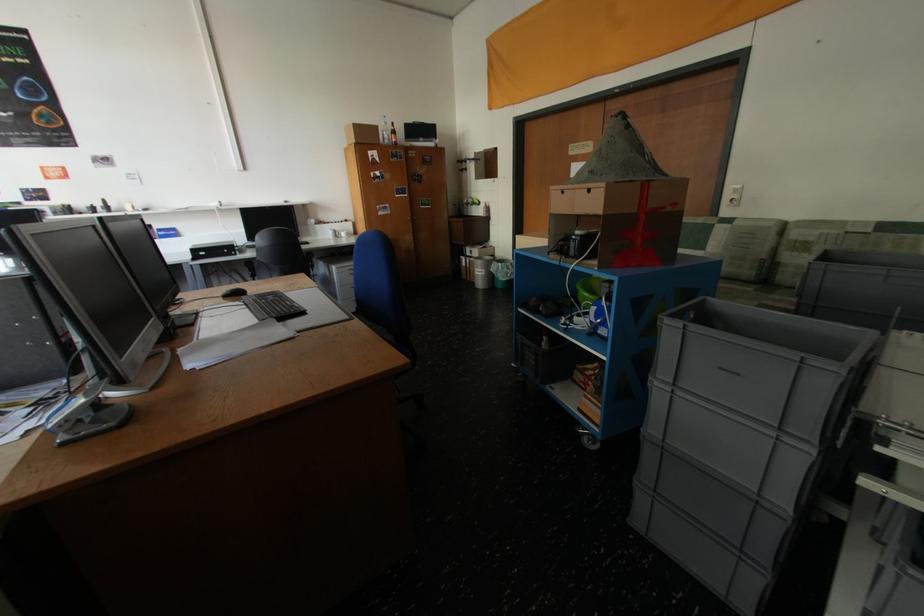
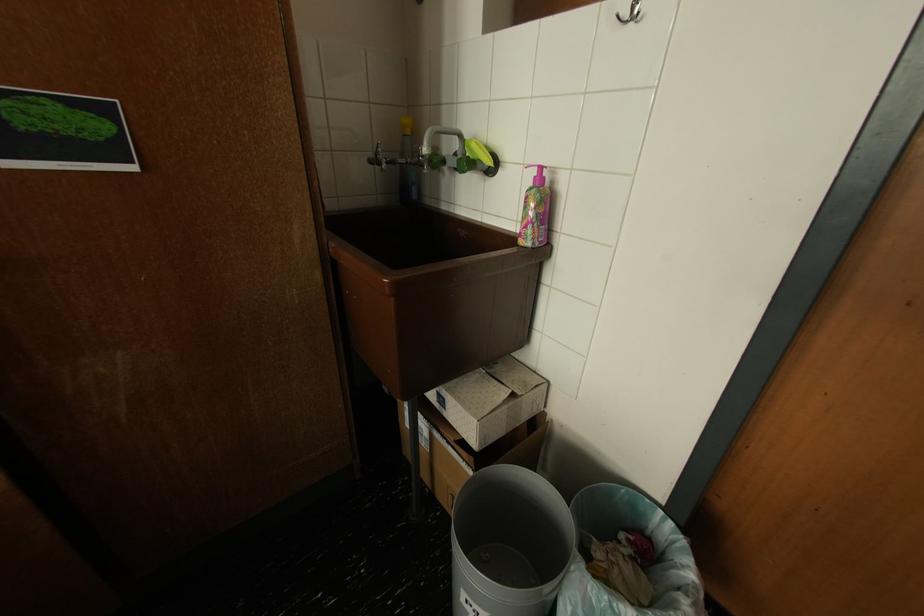
Question: Which direction would the cameraman need to move to produce the second image? Reply with the corresponding letter.

Choices:
 (A) Left
 (B) Right
 (C) Forward
 (D) Backward

Answer: (C)